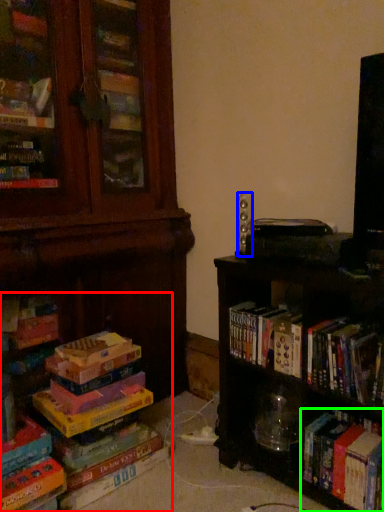
Question: Which is nearer to the book (highlighted by a red box)? speaker (highlighted by a blue box) or book (highlighted by a green box).

Choices:
 (A) speaker
 (B) book

Answer: (B)